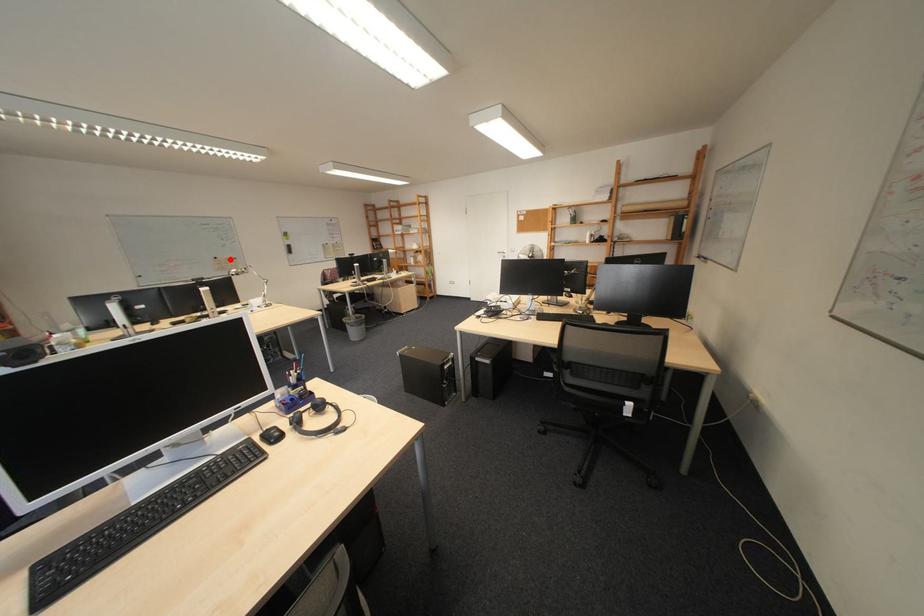
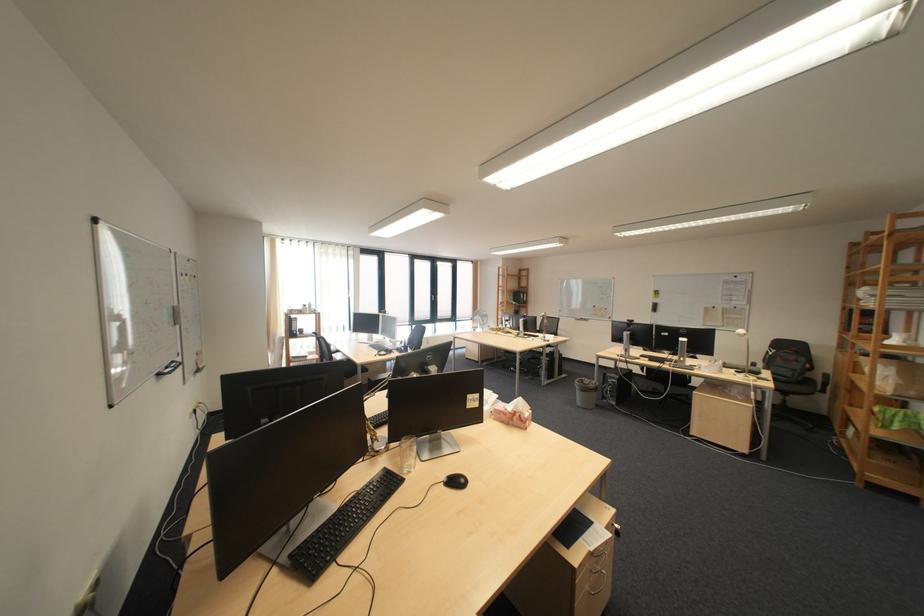
Locate, in the second image, the point that corresponds to the highlighted location in the first image.

(609, 308)